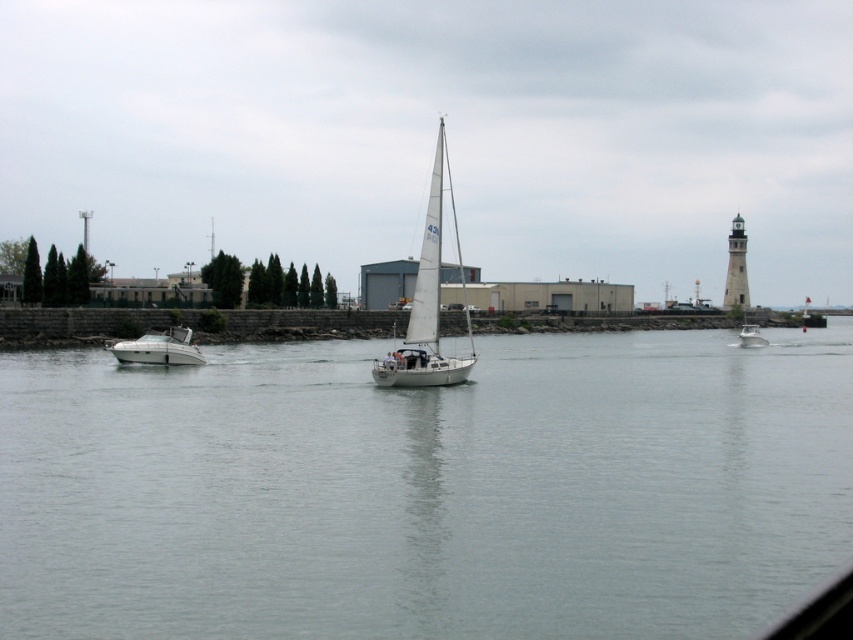
Can you confirm if white matte sailboat at center is positioned below white glossy motorboat at left?

No, white matte sailboat at center is not below white glossy motorboat at left.

Is white matte sailboat at center taller than white glossy motorboat at left?

Yes.

Describe the element at coordinates (428, 301) in the screenshot. I see `white matte sailboat at center` at that location.

Identify the location of white matte sailboat at center. This screenshot has height=640, width=853. (428, 301).

Is clear water at center taller than white stone lighthouse at right?

No, clear water at center is not taller than white stone lighthouse at right.

Which is more to the right, clear water at center or white stone lighthouse at right?

From the viewer's perspective, white stone lighthouse at right appears more on the right side.

Between point (728, 333) and point (740, 228), which one is positioned behind?

Positioned behind is point (740, 228).

I want to click on clear water at center, so click(427, 490).

Who is more distant from viewer, (x=151, y=525) or (x=744, y=346)?

Point (x=744, y=346)

Between point (372, 589) and point (761, 342), which one is positioned in front?

Point (372, 589) is in front.

Find the location of `clear water at center`. clear water at center is located at coordinates (427, 490).